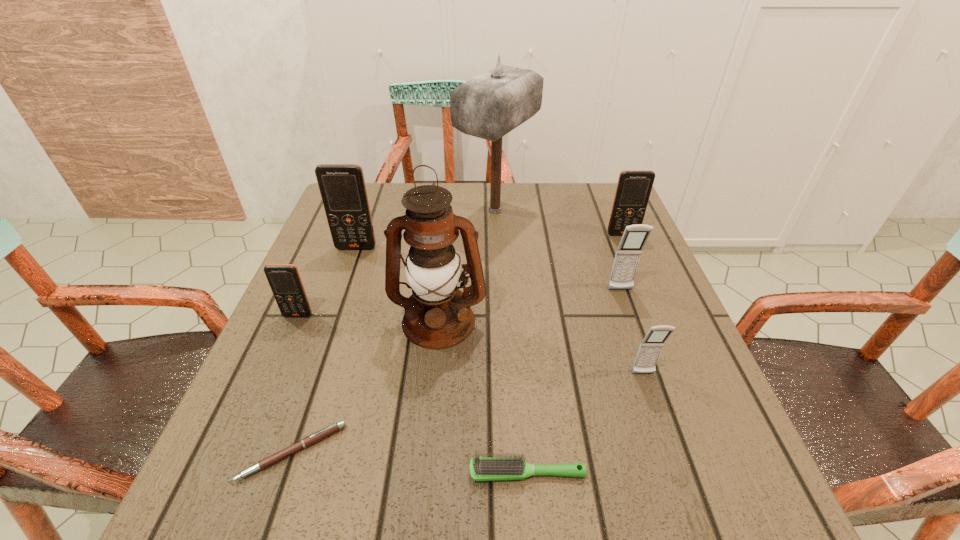
Image resolution: width=960 pixels, height=540 pixels. In order to click on the nearest orange cellular telephone in this screenshot , I will do `click(284, 279)`.

I want to click on the nearer gray cellular telephone, so click(650, 348).

Identify the location of the smaller gray cellular telephone. (650, 348).

At what (x,y) coordinates should I click in order to perform the action: click on light hairbrush. Please return your answer as a coordinate pair (x, y). The width and height of the screenshot is (960, 540). Looking at the image, I should click on (483, 468).

Find the location of `the second shortest object`. the second shortest object is located at coordinates (483, 468).

The width and height of the screenshot is (960, 540). In order to click on pen in this screenshot , I will do `click(325, 432)`.

Where is `the shortest object`? The height and width of the screenshot is (540, 960). the shortest object is located at coordinates [325, 432].

Identify the location of blank space located on the front of the mallet. The height and width of the screenshot is (540, 960). (498, 268).

The width and height of the screenshot is (960, 540). In order to click on blank space located 0.120m on the side of the lantern, there is a wick adjustment knob in this screenshot , I will do pyautogui.click(x=431, y=404).

The height and width of the screenshot is (540, 960). In order to click on free point located on the screen of the seventh shortest object in this screenshot , I will do `click(317, 362)`.